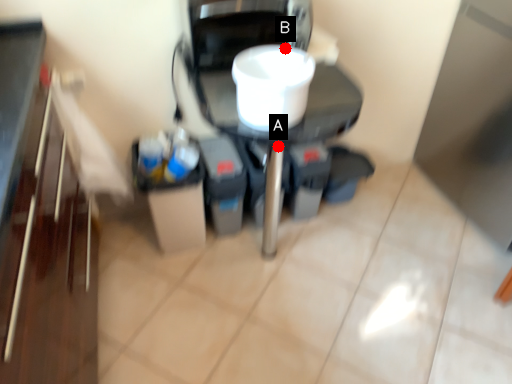
Question: Two points are circled on the image, labeled by A and B beside each circle. Which point is closer to the camera?

Choices:
 (A) A is closer
 (B) B is closer

Answer: (B)